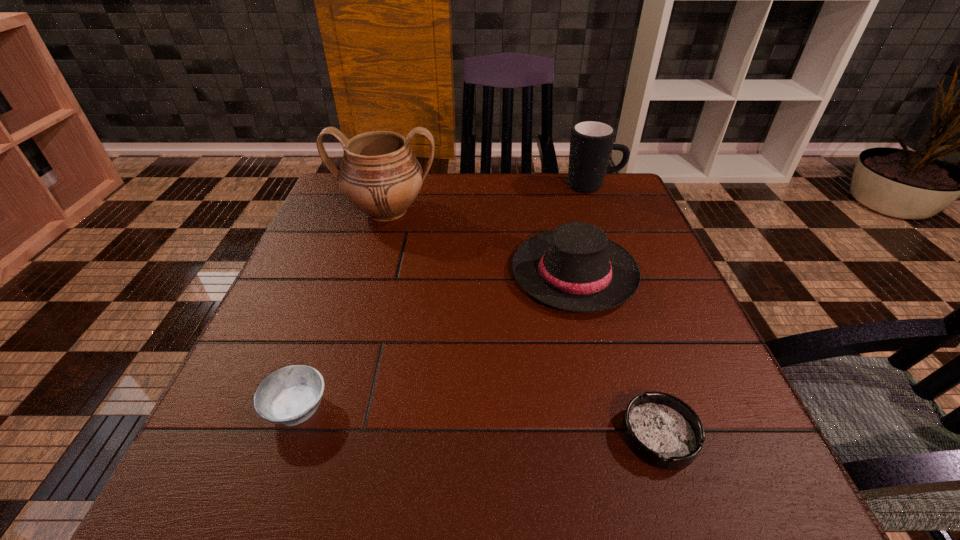
At what (x,y) coordinates should I click in order to perform the action: click on object present at the far left corner. Please return your answer as a coordinate pair (x, y). The image size is (960, 540). Looking at the image, I should click on (379, 175).

At what (x,y) coordinates should I click in order to perform the action: click on object at the far right corner. Please return your answer as a coordinate pair (x, y). The image size is (960, 540). Looking at the image, I should click on (591, 143).

Where is `object present at the near right corner`? The height and width of the screenshot is (540, 960). object present at the near right corner is located at coordinates (661, 429).

Locate an element on the screen. blank area at the far edge is located at coordinates (499, 176).

Where is `free space at the near edge of the desktop`? This screenshot has width=960, height=540. free space at the near edge of the desktop is located at coordinates (593, 477).

Locate an element on the screen. The image size is (960, 540). blank space at the left edge of the desktop is located at coordinates (301, 331).

At what (x,y) coordinates should I click in order to perform the action: click on vacant space at the right edge. Please return your answer as a coordinate pair (x, y). The image size is (960, 540). Looking at the image, I should click on (680, 337).

Locate an element on the screen. The width and height of the screenshot is (960, 540). free space at the far right corner of the desktop is located at coordinates (577, 200).

The width and height of the screenshot is (960, 540). Find the location of `empty space between the second tallest object and the second shortest object`. empty space between the second tallest object and the second shortest object is located at coordinates (445, 297).

Image resolution: width=960 pixels, height=540 pixels. I want to click on free space between the urn and the second tallest object, so click(490, 199).